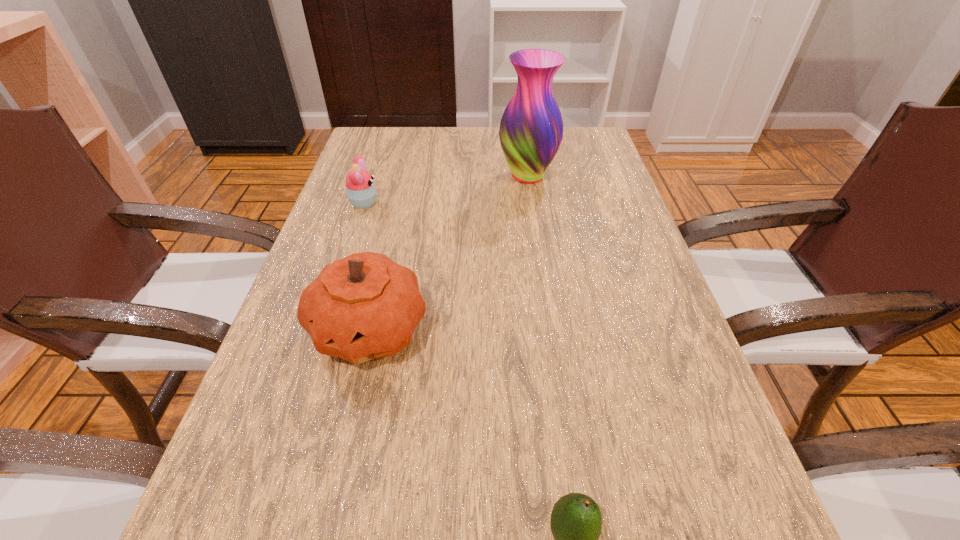
Identify the location of object that is at the right edge. (x=531, y=129).

Find the location of a particular element. object positioned at the far right corner is located at coordinates (531, 129).

Where is `vacant space at the far edge`? This screenshot has width=960, height=540. vacant space at the far edge is located at coordinates (441, 139).

The image size is (960, 540). I want to click on free location at the right edge of the desktop, so click(588, 273).

In order to click on free region at the far left corner of the desktop in this screenshot , I will do `click(368, 138)`.

The image size is (960, 540). In order to click on vacant space at the far right corner of the desktop in this screenshot , I will do `click(576, 129)`.

The image size is (960, 540). In order to click on blank region between the vase and the cupcake in this screenshot , I will do `click(445, 190)`.

This screenshot has width=960, height=540. What are the coordinates of `free area in between the vase and the second tallest object` in the screenshot? It's located at (448, 252).

The image size is (960, 540). Identify the location of free point between the cupcake and the vase. (445, 190).

Identify the location of vacant region between the tallest object and the second shortest object. (445, 190).